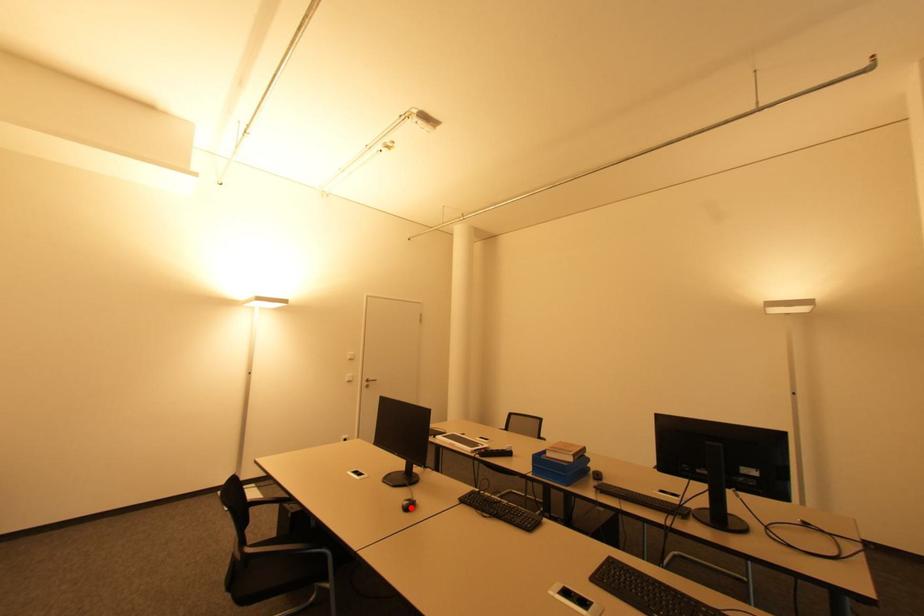
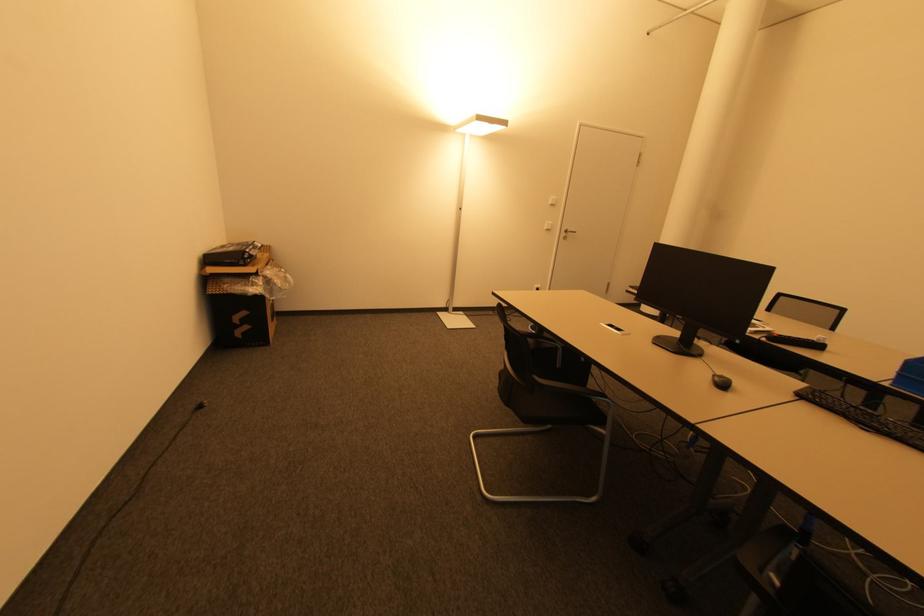
Locate, in the second image, the point that corresponds to the highlighted location in the first image.

(725, 386)